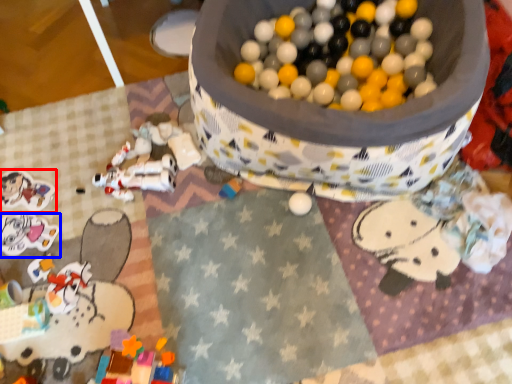
Question: Which point is closer to the camera, toy (highlighted by a red box) or toy (highlighted by a blue box)?

Choices:
 (A) toy
 (B) toy

Answer: (B)